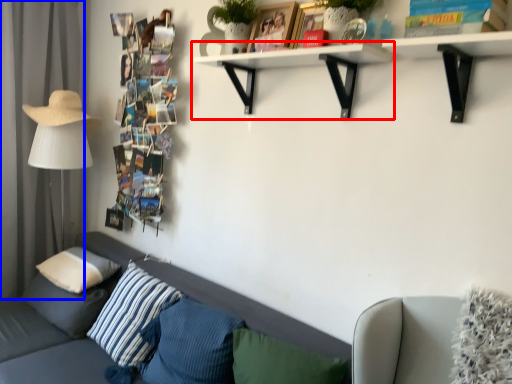
Question: Which point is further to the camera, shelf (highlighted by a red box) or curtain (highlighted by a blue box)?

Choices:
 (A) shelf
 (B) curtain

Answer: (B)